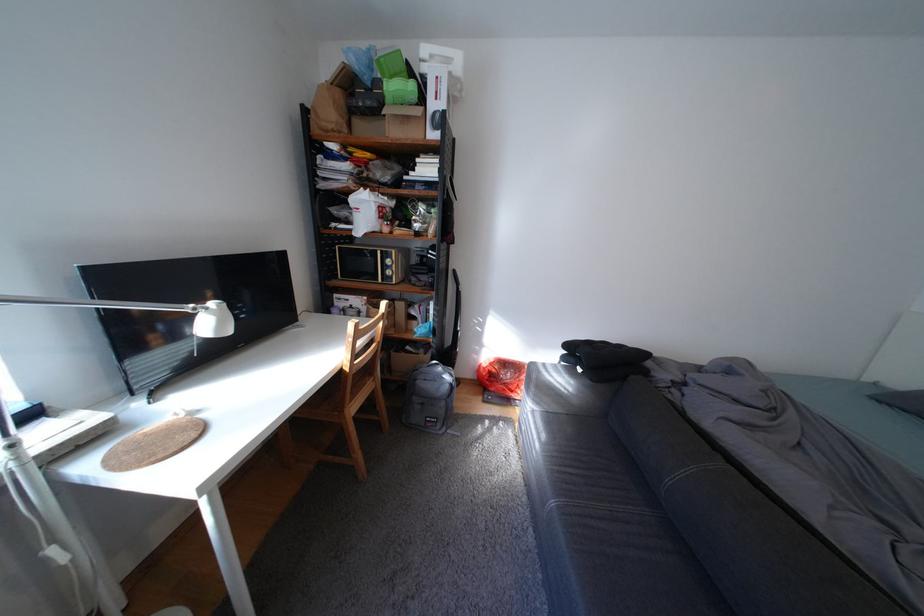
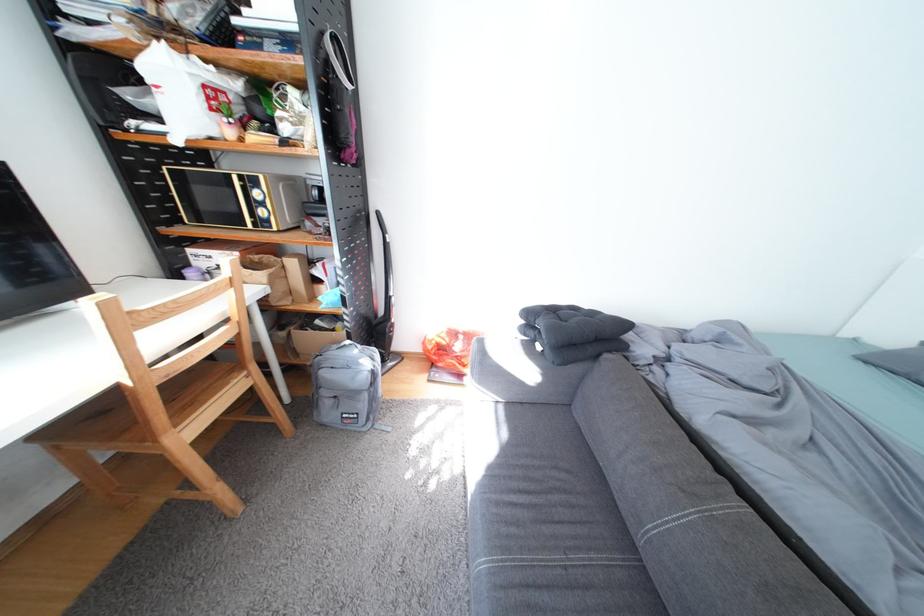
Locate, in the second image, the point that corresponds to (456,405) in the first image.

(378, 397)